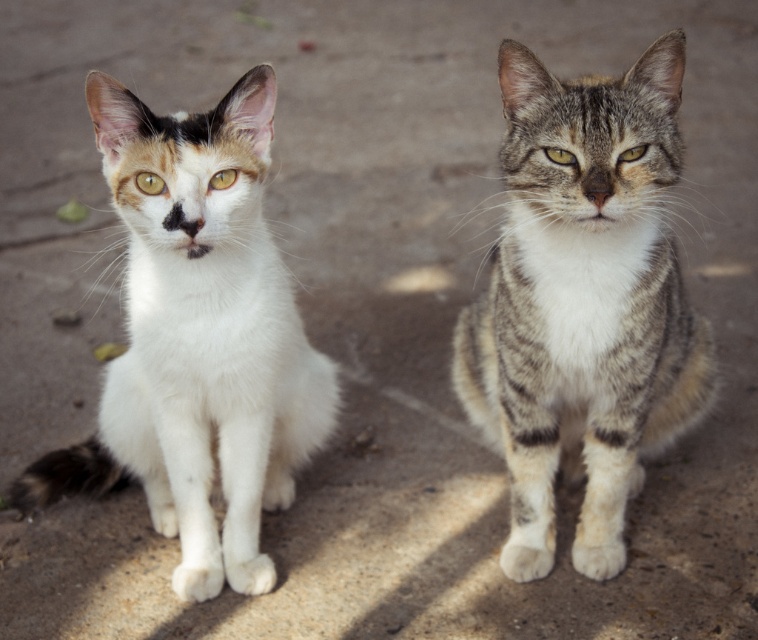
Can you confirm if tabby fur cat at center is taller than white soft fur cat at left?

Correct, tabby fur cat at center is much taller as white soft fur cat at left.

The image size is (758, 640). I want to click on tabby fur cat at center, so click(583, 304).